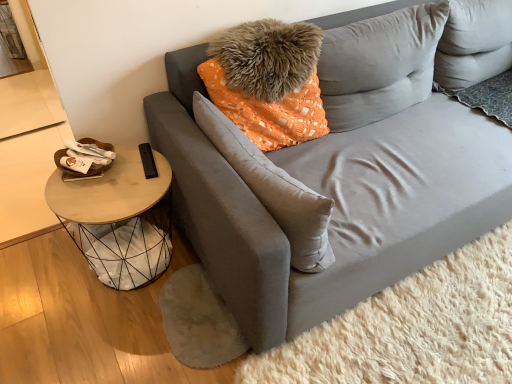
Question: Is velvet gray couch at center at the left side of woodenmaterial/texture side table at left?

Choices:
 (A) yes
 (B) no

Answer: (B)

Question: Considering the relative sizes of velvet gray couch at center and woodenmaterial/texture side table at left in the image provided, is velvet gray couch at center shorter than woodenmaterial/texture side table at left?

Choices:
 (A) yes
 (B) no

Answer: (B)

Question: Considering the relative sizes of velvet gray couch at center and woodenmaterial/texture side table at left in the image provided, is velvet gray couch at center bigger than woodenmaterial/texture side table at left?

Choices:
 (A) yes
 (B) no

Answer: (A)

Question: Is velvet gray couch at center surrounding woodenmaterial/texture side table at left?

Choices:
 (A) no
 (B) yes

Answer: (A)

Question: Is the depth of velvet gray couch at center less than that of woodenmaterial/texture side table at left?

Choices:
 (A) no
 (B) yes

Answer: (B)

Question: From a real-world perspective, is velvet gray couch at center above or below suede gray pillow at center, which appears as the second pillow when viewed from the right?

Choices:
 (A) above
 (B) below

Answer: (B)

Question: Is velvet gray couch at center in front of or behind suede gray pillow at center, which appears as the second pillow when viewed from the right, in the image?

Choices:
 (A) behind
 (B) front

Answer: (B)

Question: In terms of size, does velvet gray couch at center appear bigger or smaller than suede gray pillow at center, marked as the 1th pillow in a left-to-right arrangement?

Choices:
 (A) big
 (B) small

Answer: (A)

Question: In the image, is velvet gray couch at center on the left side or the right side of suede gray pillow at center, which appears as the second pillow when viewed from the right?

Choices:
 (A) right
 (B) left

Answer: (A)

Question: From the image's perspective, is velvety gray pillow at upper right, arranged as the 1th pillow when viewed from the right, located above or below velvet gray couch at center?

Choices:
 (A) above
 (B) below

Answer: (A)

Question: From a real-world perspective, is velvety gray pillow at upper right, placed as the 2th pillow when sorted from left to right, physically located above or below velvet gray couch at center?

Choices:
 (A) below
 (B) above

Answer: (B)

Question: Relative to velvet gray couch at center, is velvety gray pillow at upper right, arranged as the 1th pillow when viewed from the right, in front or behind?

Choices:
 (A) behind
 (B) front

Answer: (A)

Question: From their relative heights in the image, would you say velvety gray pillow at upper right, placed as the 2th pillow when sorted from left to right, is taller or shorter than velvet gray couch at center?

Choices:
 (A) short
 (B) tall

Answer: (A)

Question: In terms of height, does suede gray pillow at center, which appears as the second pillow when viewed from the right, look taller or shorter compared to woodenmaterial/texture side table at left?

Choices:
 (A) tall
 (B) short

Answer: (B)

Question: In the image, is suede gray pillow at center, marked as the 1th pillow in a left-to-right arrangement, positioned in front of or behind woodenmaterial/texture side table at left?

Choices:
 (A) front
 (B) behind

Answer: (A)